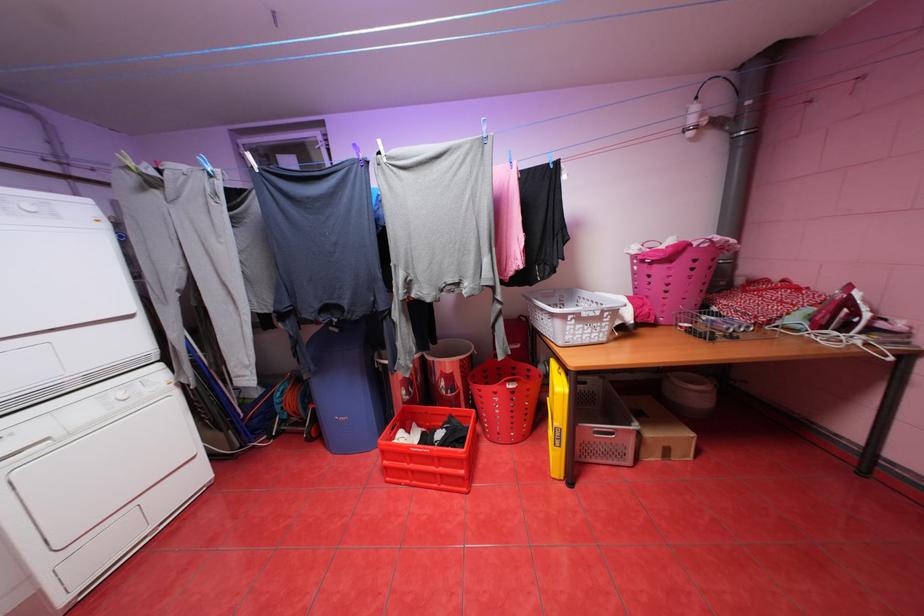
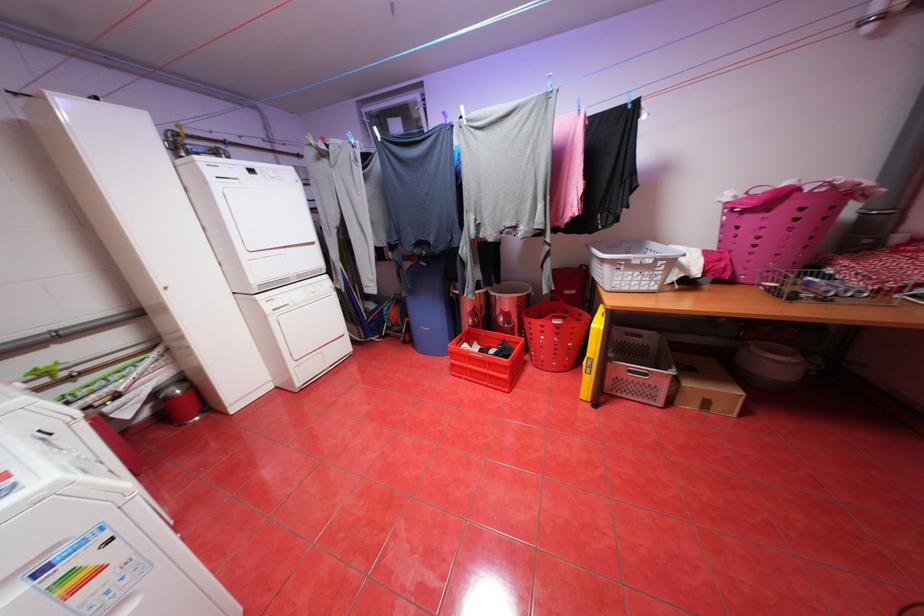
In the second image, find the point that corresponds to [598,460] in the first image.

(627, 394)